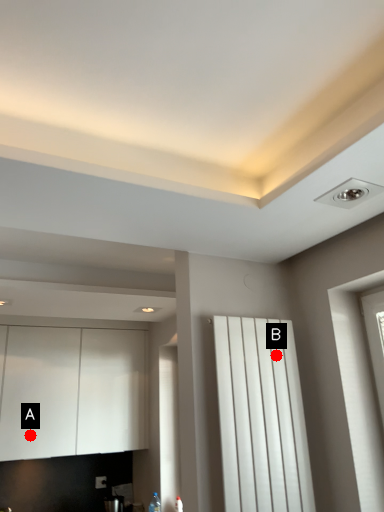
Question: Two points are circled on the image, labeled by A and B beside each circle. Which of the following is the closest to the observer?

Choices:
 (A) A is closer
 (B) B is closer

Answer: (B)